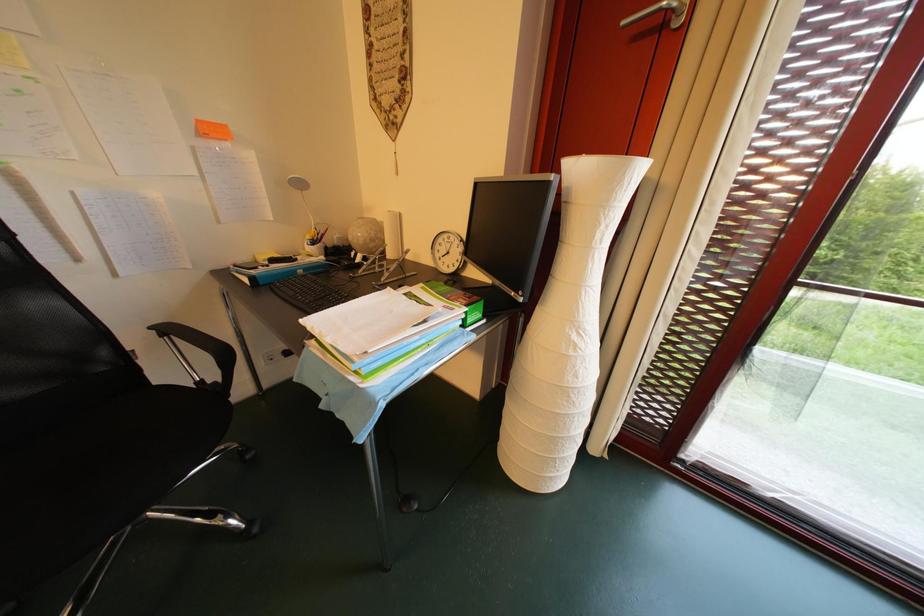
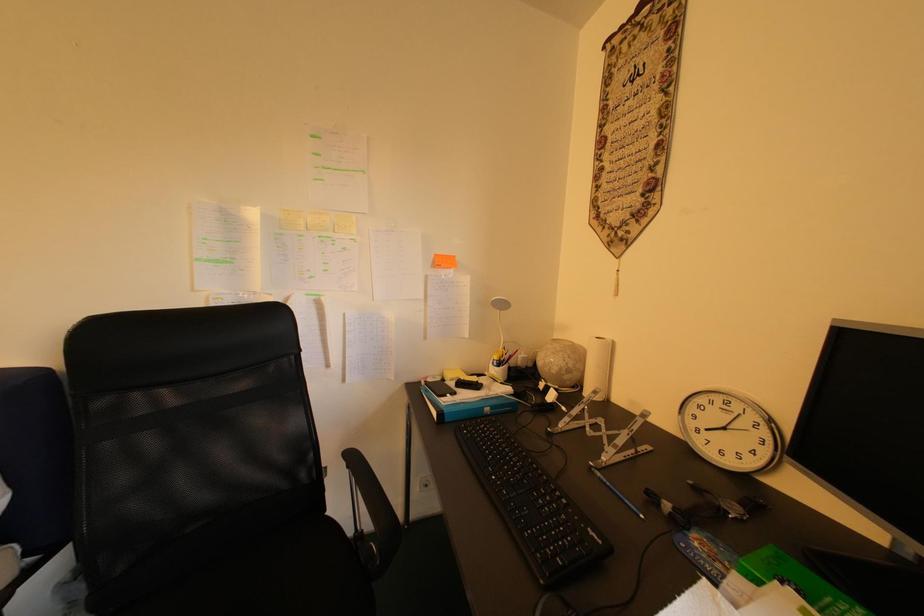
The images are taken continuously from a first-person perspective. In which direction is your viewpoint rotating?

The rotation direction of the camera is left-up.